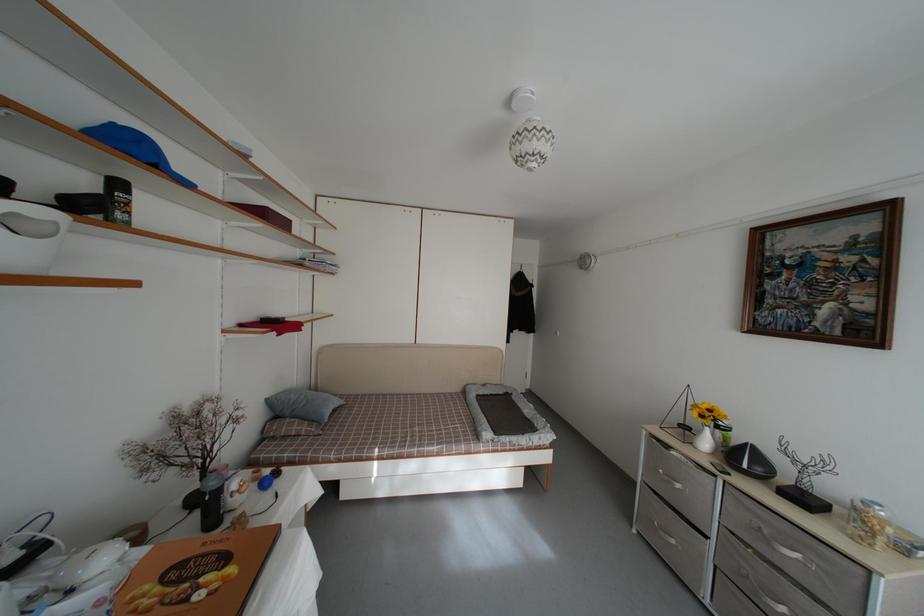
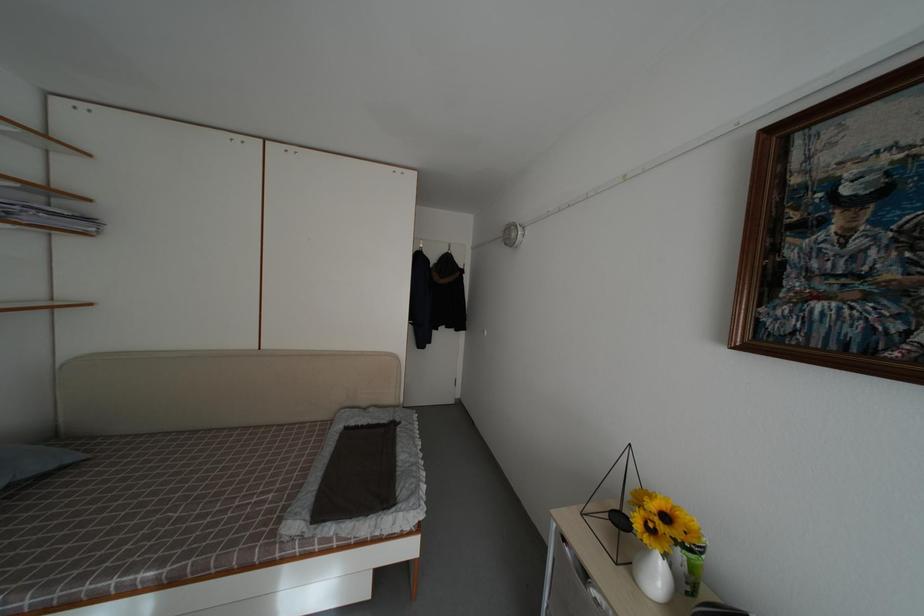
Locate, in the second image, the point that corresponds to [348,408] in the first image.

(80, 464)